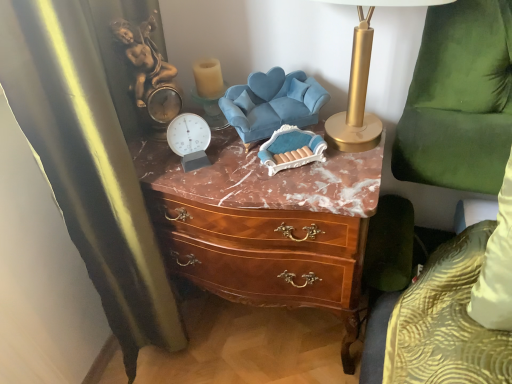
The height and width of the screenshot is (384, 512). In order to click on spots to the right of metallic silver clock at center in this screenshot , I will do `click(266, 175)`.